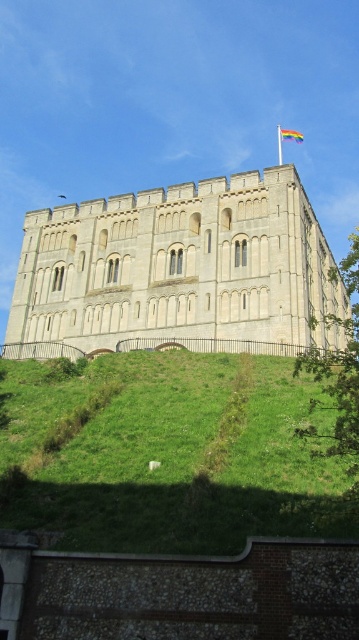
Question: In this image, where is beige stone castle at center located relative to green leafy tree at right?

Choices:
 (A) above
 (B) below

Answer: (B)

Question: Which is farther from the green grassy hill at lower center?

Choices:
 (A) beige stone castle at center
 (B) green leafy tree at right

Answer: (A)

Question: Estimate the real-world distances between objects in this image. Which object is closer to the beige stone castle at center?

Choices:
 (A) green grassy hill at lower center
 (B) green leafy tree at right

Answer: (A)

Question: Among these points, which one is nearest to the camera?

Choices:
 (A) (280, 257)
 (B) (212, 372)

Answer: (B)

Question: Is green grassy hill at lower center positioned behind beige stone castle at center?

Choices:
 (A) no
 (B) yes

Answer: (A)

Question: Is beige stone castle at center below green leafy tree at right?

Choices:
 (A) yes
 (B) no

Answer: (A)